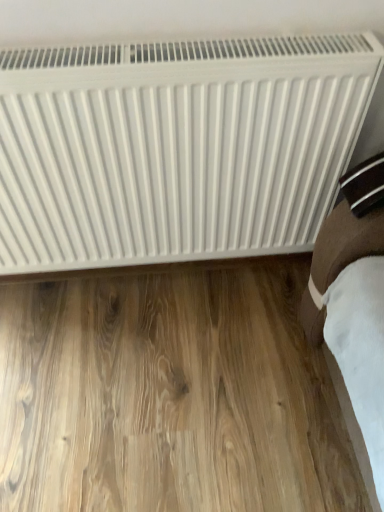
Find the location of a particular element. The width and height of the screenshot is (384, 512). vacant space underneath white matte radiator at upper center (from a real-world perspective) is located at coordinates (178, 283).